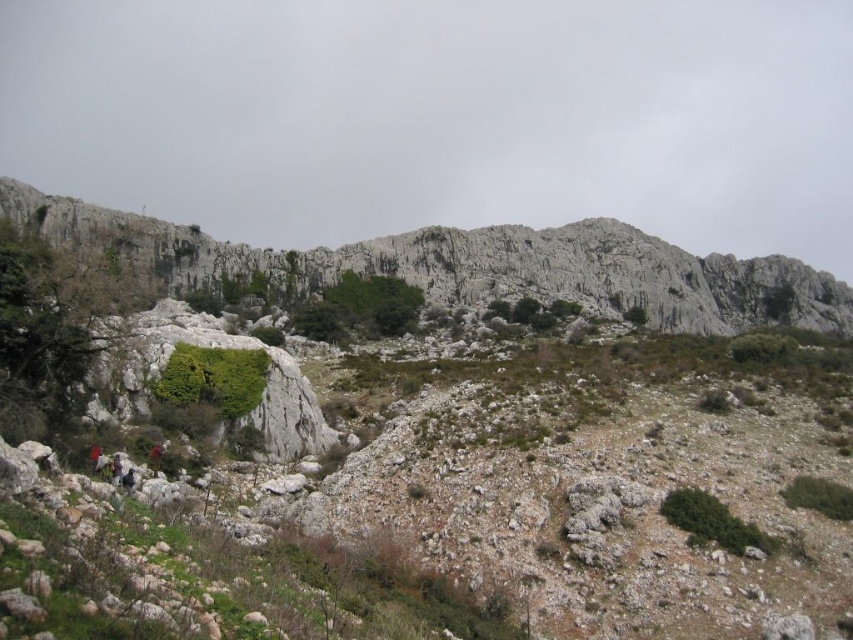
You are a hiker planning to take a photo of the rugged stone mountain at upper center and the red fabric person at lower left. Which object should you frame first in your camera to capture their full width in the shot?

You should frame the rugged stone mountain at upper center first because its width is larger than the red fabric person at lower left, so you need to ensure it fits entirely in the frame before adjusting for the smaller width of the red fabric person at lower left.

You are a photographer planning to capture a landscape shot of the rugged stone mountain at upper center and the red fabric person at lower left. Based on their sizes, which object should you focus on first to ensure it fills the frame adequately?

The rugged stone mountain at upper center is larger in size than the red fabric person at lower left, so you should focus on the rugged stone mountain at upper center first to ensure it fills the frame adequately.

You are a hiker standing at the base of the rugged stone mountain at upper center. You want to reach the summit. According to your GPS, the distance to the summit is 133.93 meters. If you walk at a steady pace of 3 km per hour, how long will it take you to reach the summit?

The rugged stone mountain at upper center is 133.93 meters away from the viewer. To reach the summit, it would take approximately 26.79 minutes since 133.93 meters divided by 3 km per hour equals 0.0446 hours, which converts to roughly 2.68 minutes per kilometer, so 26.79 minutes total.